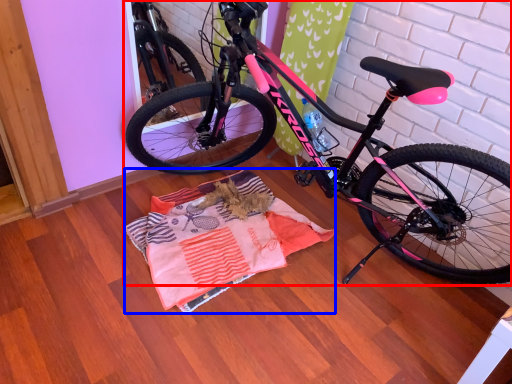
Question: Which object appears closest to the camera in this image, bicycle (highlighted by a red box) or blanket (highlighted by a blue box)?

Choices:
 (A) bicycle
 (B) blanket

Answer: (A)